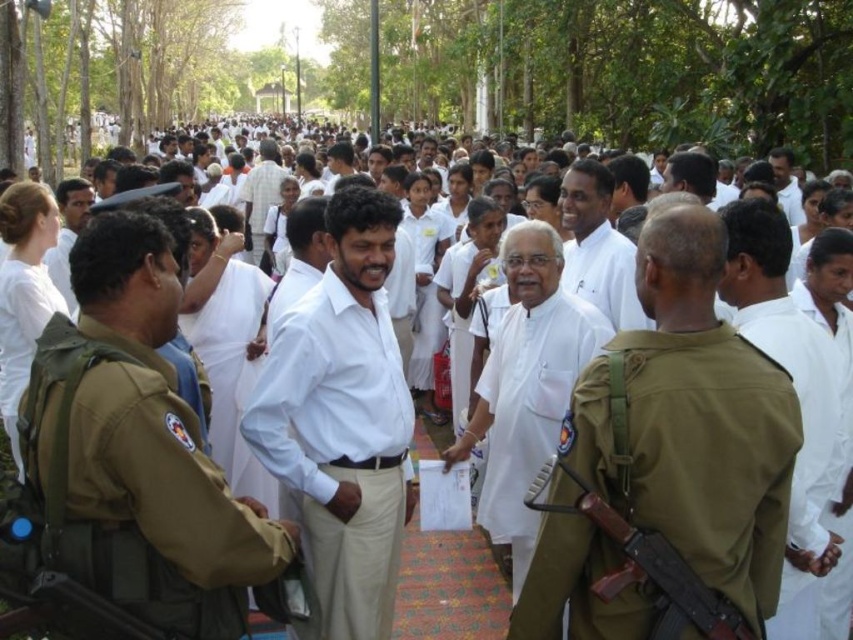
From the picture: You are standing in the park and see two points marked in the image. Which point, point [759,298] or point [624,252], is nearer to you?

Point [759,298] is closer to the camera than point [624,252], so it is nearer to you.

You are standing at the origin point in the image and want to move towards the point labeled point (538, 467). Will you pass by point (780, 179) first before reaching your destination?

Since point (538, 467) is in front of point (780, 179), you will reach point (538, 467) before passing point (780, 179). Therefore, you will not pass by point (780, 179) first before reaching your destination.

You are a photographer at the event and want to capture a photo of the white cloth at center and the white clothed man at center. Based on their positions, which object is positioned to the right of the other?

The white cloth at center is to the right of the white clothed man at center.